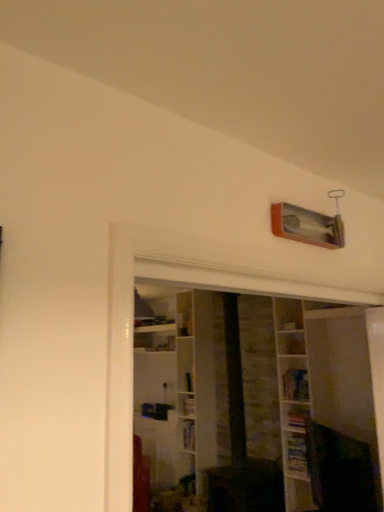
Question: Is hardcover book at lower right, positioned as the 1th book in bottom-to-top order, positioned behind hardcover book at upper center, the 3th book positioned from the bottom?

Choices:
 (A) no
 (B) yes

Answer: (A)

Question: Is hardcover book at lower right, the 3th book from the top, completely or partially outside of hardcover book at upper center, which appears as the 1th book when viewed from the top?

Choices:
 (A) no
 (B) yes

Answer: (B)

Question: Is hardcover book at lower right, positioned as the 1th book in bottom-to-top order, thinner than hardcover book at upper center, the 3th book positioned from the bottom?

Choices:
 (A) no
 (B) yes

Answer: (B)

Question: Is hardcover book at lower right, the 3th book from the top, directly adjacent to hardcover book at upper center, which appears as the 1th book when viewed from the top?

Choices:
 (A) yes
 (B) no

Answer: (B)

Question: Considering the relative sizes of hardcover book at lower right, the 3th book from the top, and hardcover book at upper center, which appears as the 1th book when viewed from the top, in the image provided, is hardcover book at lower right, the 3th book from the top, wider than hardcover book at upper center, which appears as the 1th book when viewed from the top,?

Choices:
 (A) yes
 (B) no

Answer: (B)

Question: Would you say hardcover book at upper center, the 3th book positioned from the bottom, is part of hardcover book at lower right, the 3th book from the top,'s contents?

Choices:
 (A) yes
 (B) no

Answer: (B)

Question: Can you confirm if hardcover book at lower right, positioned as the second book in bottom-to-top order, is positioned to the left of hardcover book at lower right, the 3th book from the top?

Choices:
 (A) yes
 (B) no

Answer: (B)

Question: Does hardcover book at lower right, placed as the second book when sorted from top to bottom, lie in front of hardcover book at lower right, positioned as the 1th book in bottom-to-top order?

Choices:
 (A) no
 (B) yes

Answer: (A)

Question: Is hardcover book at lower right, placed as the second book when sorted from top to bottom, located outside hardcover book at lower right, positioned as the 1th book in bottom-to-top order?

Choices:
 (A) no
 (B) yes

Answer: (B)

Question: Considering the relative sizes of hardcover book at lower right, placed as the second book when sorted from top to bottom, and hardcover book at lower right, the 3th book from the top, in the image provided, is hardcover book at lower right, placed as the second book when sorted from top to bottom, thinner than hardcover book at lower right, the 3th book from the top,?

Choices:
 (A) no
 (B) yes

Answer: (A)

Question: Is hardcover book at lower right, placed as the second book when sorted from top to bottom, at the right side of hardcover book at lower right, positioned as the 1th book in bottom-to-top order?

Choices:
 (A) no
 (B) yes

Answer: (B)

Question: Considering the relative sizes of hardcover book at lower right, positioned as the second book in bottom-to-top order, and hardcover book at lower right, the 3th book from the top, in the image provided, is hardcover book at lower right, positioned as the second book in bottom-to-top order, shorter than hardcover book at lower right, the 3th book from the top,?

Choices:
 (A) yes
 (B) no

Answer: (A)

Question: Is hardcover book at lower right, positioned as the second book in bottom-to-top order, touching hardcover book at upper center, the 3th book positioned from the bottom?

Choices:
 (A) no
 (B) yes

Answer: (A)